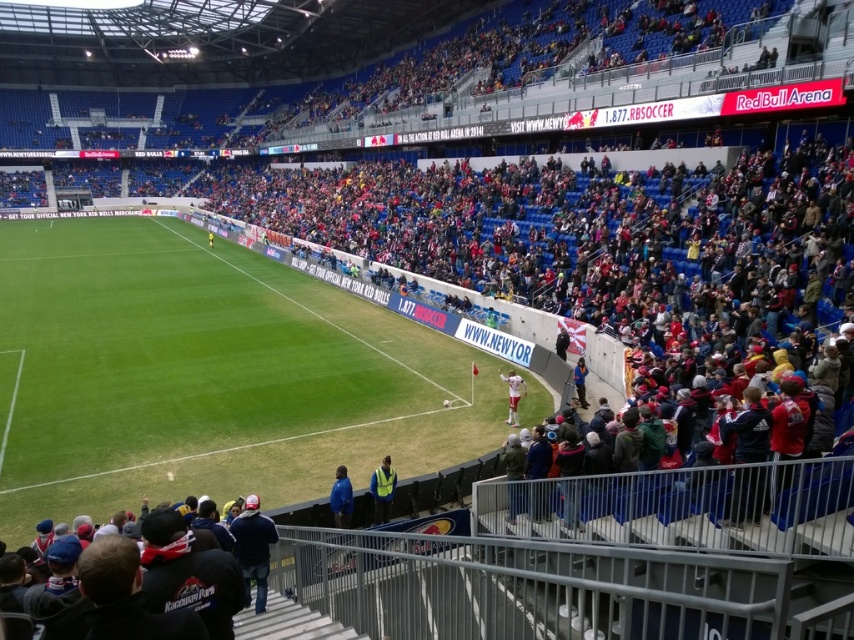
You are a drone operator trying to capture aerial footage of the soccer match at Red Bull Arena. You need to fly the drone from point A to point B. Given that point A is at coordinates point (186, 534) and point B is at coordinates point (344, 486), which point should you start your flight from to ensure the drone is closer to the field surface initially?

You should start the drone at point (186, 534) because it is closer to the viewer than point (344, 486), meaning it would be positioned lower and closer to the field surface initially.

You are a groundskeeper at Red Bull Arena and need to place a new yellow reflective vest at center and a white fabric shirt at lower right. Given that the vest is taller than the shirt, where should you position them to ensure visibility from the upper deck seats?

The yellow reflective vest at center should be placed higher up since it is taller than the white fabric shirt at lower right, ensuring better visibility from the upper deck seats.

You are a drone operator tasked with capturing aerial footage of the soccer match at Red Bull Arena. Your drone is currently positioned above the dark blue jacket at lower center. To ensure optimal coverage, you need to adjust the drone to face the field. Based on the jacket location, in which general direction should you direct the drone to capture the field? Please respond with either north, south, east, or west.

The dark blue jacket at lower center is located at coordinates approximately 0.895 on the x and 0.227 on the y. Since the field is typically oriented north to south in such stadiums, the drone should be directed north to capture the field.